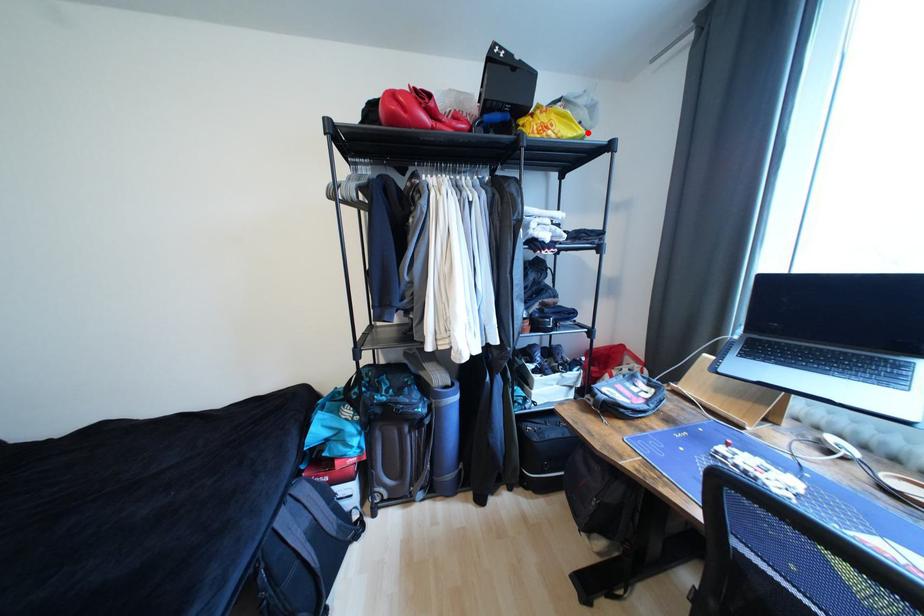
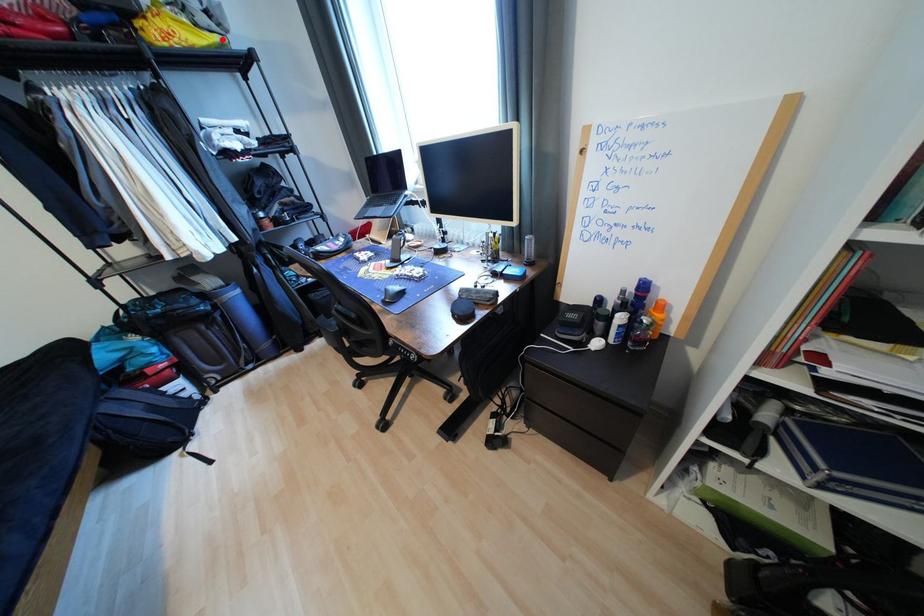
I am providing you with two images of the same scene from different viewpoints. A red point is marked on the first image and another point is marked on the second image. Does the point marked in image1 correspond to the same location as the one in image2?

Yes